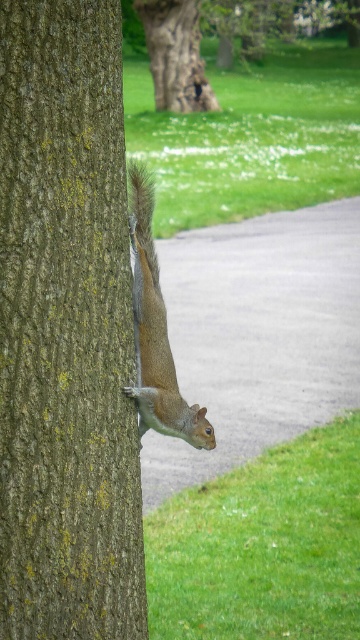
Question: Can you confirm if smooth brown bark at center is positioned below fuzzy brown tail at upper right?

Choices:
 (A) yes
 (B) no

Answer: (A)

Question: Among these objects, which one is nearest to the camera?

Choices:
 (A) shiny brown squirrel at left
 (B) smooth brown bark at upper center
 (C) brown rough bark at upper center
 (D) fuzzy brown tail at upper right

Answer: (A)

Question: Does brown rough bark at upper center appear on the left side of smooth brown bark at upper center?

Choices:
 (A) yes
 (B) no

Answer: (B)

Question: Which of these objects is positioned farthest from the smooth brown bark at center?

Choices:
 (A) fuzzy brown tail at upper right
 (B) brown rough bark at upper center
 (C) shiny brown squirrel at left

Answer: (B)

Question: Considering the real-world distances, which object is farthest from the brown rough bark at upper center?

Choices:
 (A) smooth brown bark at upper center
 (B) fuzzy brown tail at upper right
 (C) shiny brown squirrel at left

Answer: (C)

Question: Considering the relative positions of shiny brown squirrel at left and smooth brown bark at upper center in the image provided, where is shiny brown squirrel at left located with respect to smooth brown bark at upper center?

Choices:
 (A) below
 (B) above

Answer: (A)